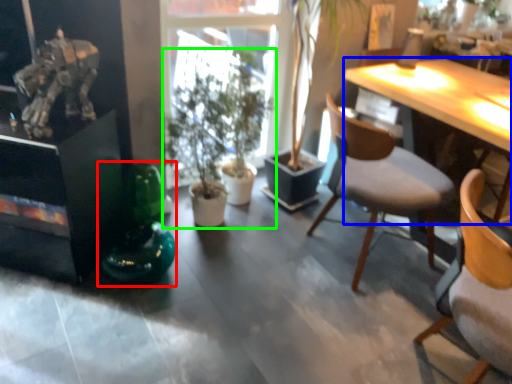
Question: Based on their relative distances, which object is farther from toy (highlighted by a red box)? Choose from desk (highlighted by a blue box) and houseplant (highlighted by a green box).

Choices:
 (A) desk
 (B) houseplant

Answer: (A)